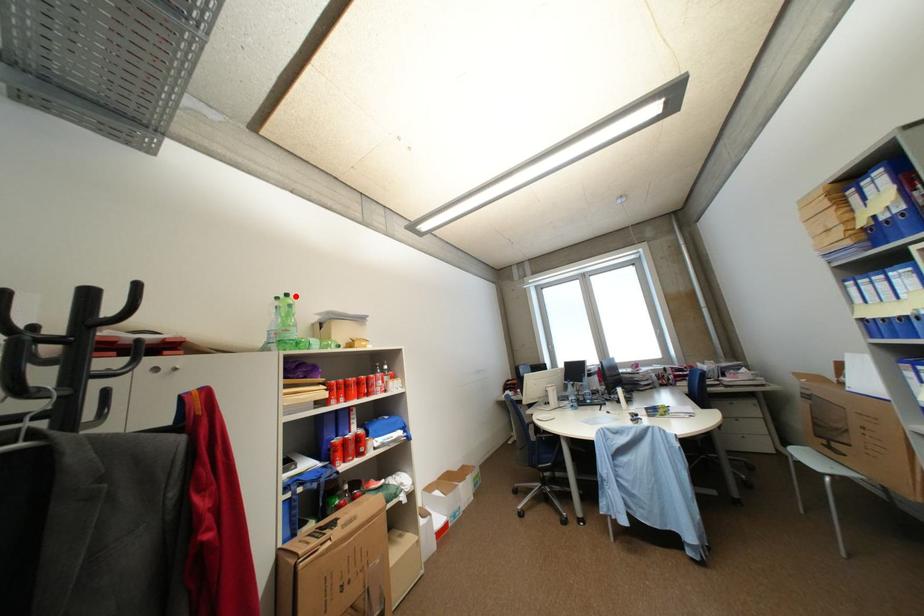
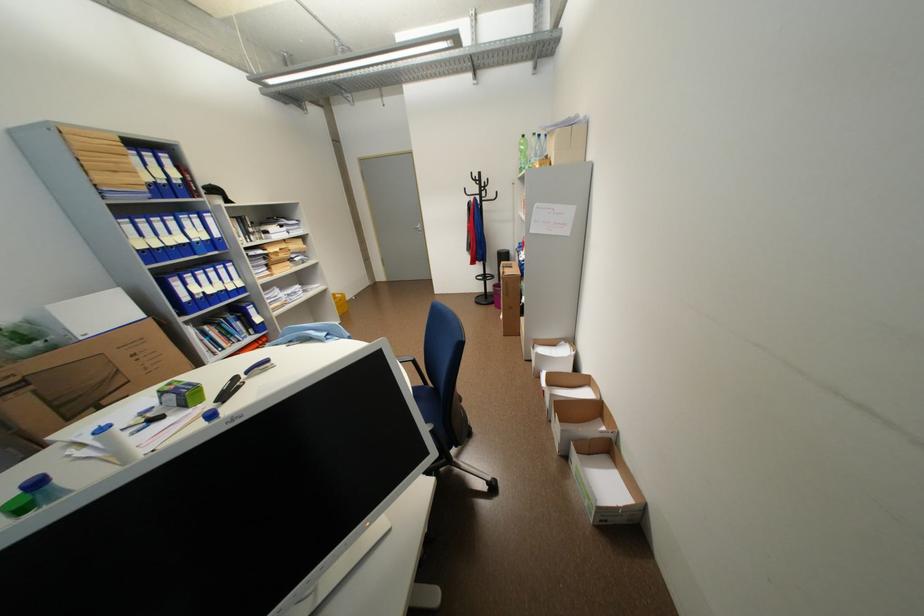
Question: I am providing you with two images of the same scene from different viewpoints. Image1 has a red point marked. In image2, the corresponding 3D location appears at what relative position? Reply with the corresponding letter.

Choices:
 (A) Closer
 (B) Farther

Answer: (A)